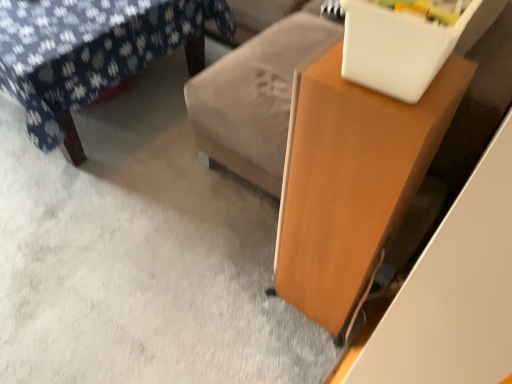
Question: Considering the positions of wooden table at right and velvet floral-patterned ottoman at upper left in the image, is wooden table at right bigger or smaller than velvet floral-patterned ottoman at upper left?

Choices:
 (A) big
 (B) small

Answer: (B)

Question: From a real-world perspective, relative to velvet floral-patterned ottoman at upper left, is wooden table at right vertically above or below?

Choices:
 (A) above
 (B) below

Answer: (A)

Question: Does point (308, 314) appear closer or farther from the camera than point (46, 119)?

Choices:
 (A) farther
 (B) closer

Answer: (B)

Question: From a real-world perspective, is velvet floral-patterned ottoman at upper left physically located above or below wooden table at right?

Choices:
 (A) above
 (B) below

Answer: (B)

Question: In terms of width, does velvet floral-patterned ottoman at upper left look wider or thinner when compared to wooden table at right?

Choices:
 (A) thin
 (B) wide

Answer: (B)

Question: In terms of size, does velvet floral-patterned ottoman at upper left appear bigger or smaller than wooden table at right?

Choices:
 (A) big
 (B) small

Answer: (A)

Question: Is velvet floral-patterned ottoman at upper left taller or shorter than wooden table at right?

Choices:
 (A) tall
 (B) short

Answer: (B)